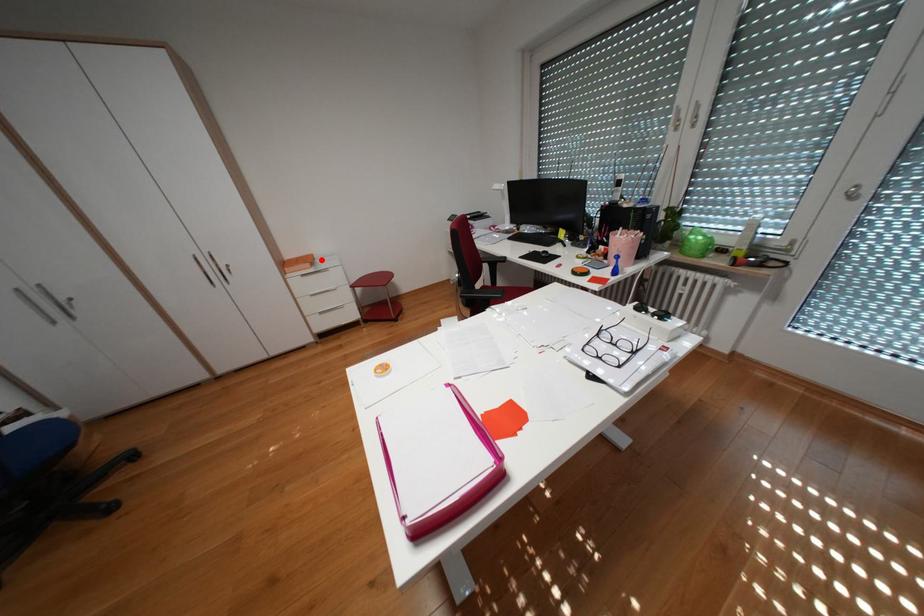
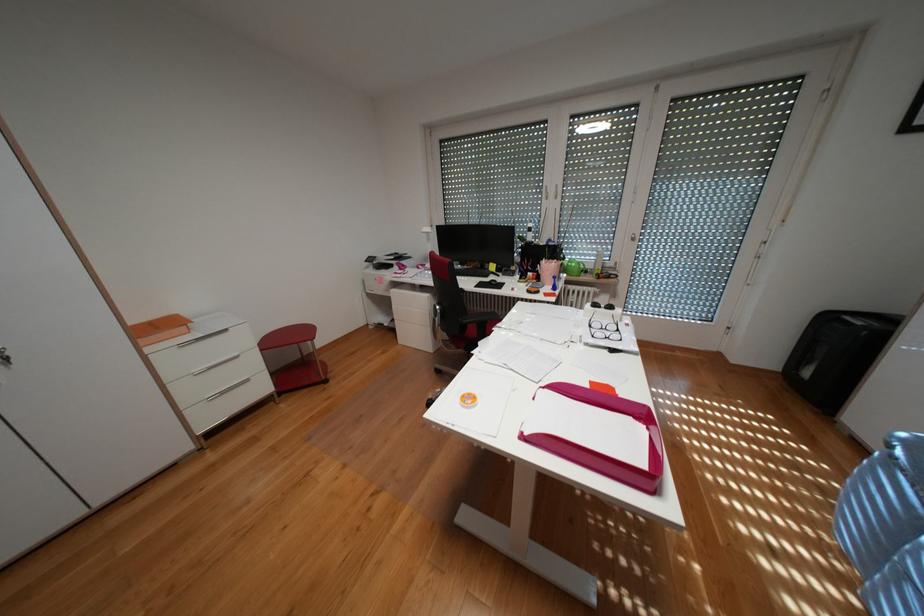
Question: I am providing you with two images of the same scene from different viewpoints. A red point is marked on the first image. Is the red point's position out of view in image 2?

Choices:
 (A) Yes
 (B) No

Answer: (B)